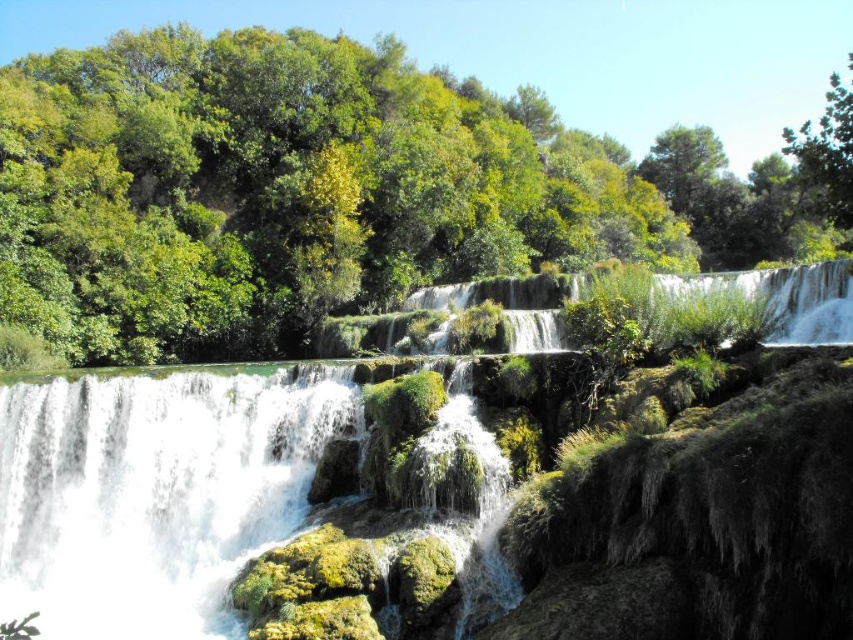
Does green leafy tree at upper center appear on the left side of white frothy water at center?

No, green leafy tree at upper center is not to the left of white frothy water at center.

Between green leafy tree at upper center and white frothy water at center, which one has less height?

With less height is white frothy water at center.

Measure the distance between green leafy tree at upper center and camera.

green leafy tree at upper center is 62.91 feet away from camera.

I want to click on green leafy tree at upper center, so click(x=326, y=193).

In the scene shown: Does white frothy water at center have a lesser width compared to green leafy tree at upper right?

Indeed, white frothy water at center has a lesser width compared to green leafy tree at upper right.

Is point (456, 636) closer to viewer compared to point (811, 136)?

Yes, point (456, 636) is closer to viewer.

Between point (225, 564) and point (786, 131), which one is positioned behind?

Positioned behind is point (786, 131).

The width and height of the screenshot is (853, 640). Identify the location of white frothy water at center. (155, 492).

Does green leafy tree at upper center have a lesser height compared to green leafy tree at upper right?

Correct, green leafy tree at upper center is not as tall as green leafy tree at upper right.

Is green leafy tree at upper center to the right of green leafy tree at upper right from the viewer's perspective?

Incorrect, green leafy tree at upper center is not on the right side of green leafy tree at upper right.

In order to click on green leafy tree at upper center in this screenshot , I will do `click(326, 193)`.